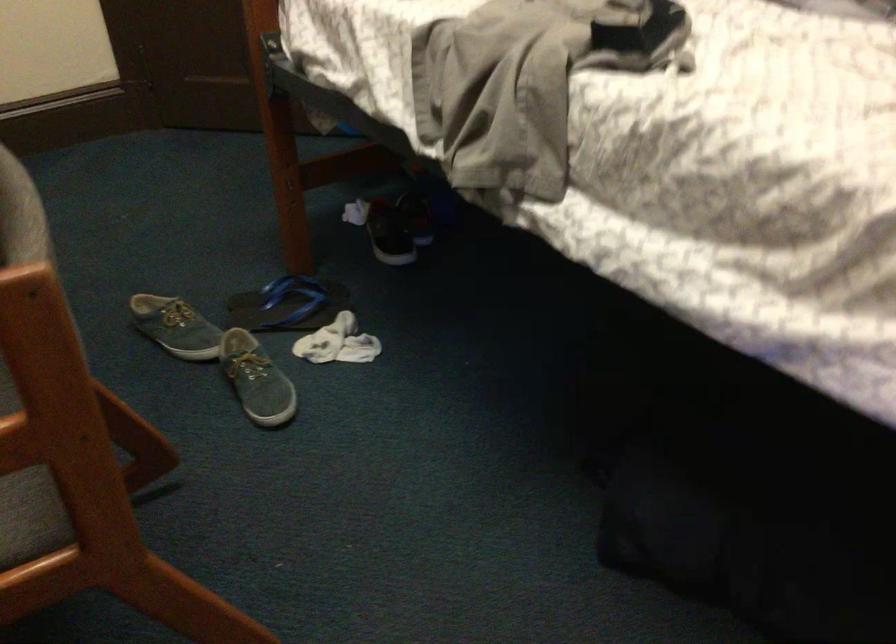
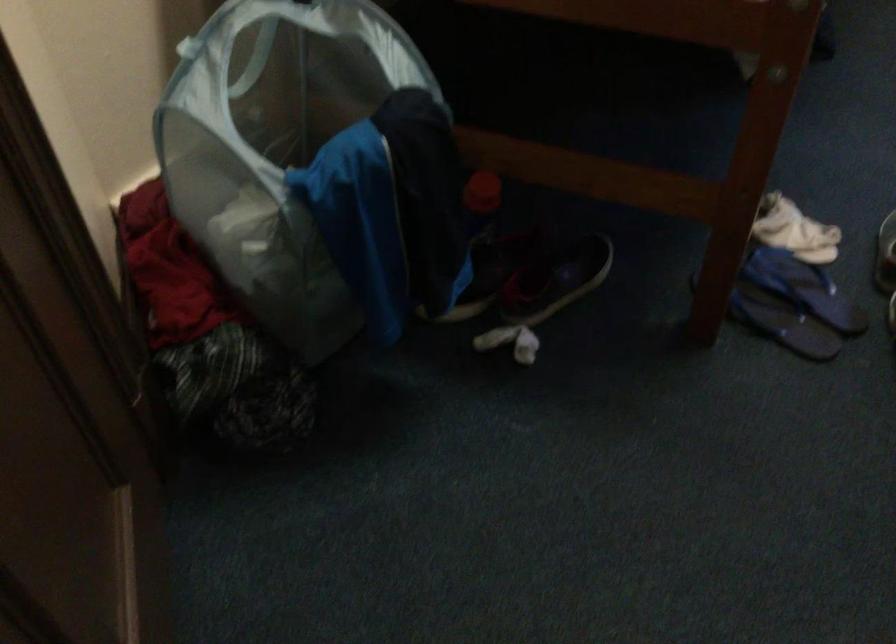
In the second image, find the point that corresponds to pixel 367 216 in the first image.

(556, 279)